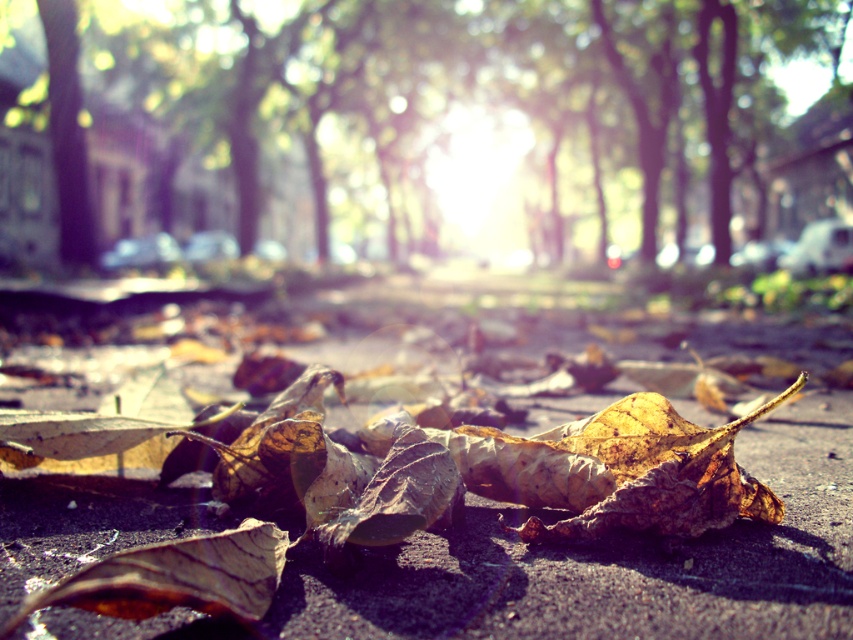
Question: Which object is positioned farthest from the brown papery leaf at lower center?

Choices:
 (A) brown textured leaves at center
 (B) brown/dry leaf at center
 (C) brown/dry leaves at center
 (D) brown papery leaf at lower left

Answer: (C)

Question: Does brown/dry leaves at center have a smaller size compared to brown papery leaf at lower left?

Choices:
 (A) no
 (B) yes

Answer: (A)

Question: Which point is closer to the camera?

Choices:
 (A) [315, 358]
 (B) [259, 554]

Answer: (B)

Question: Does brown papery leaf at lower left have a lesser width compared to brown/dry leaf at center?

Choices:
 (A) yes
 (B) no

Answer: (B)

Question: Is brown/dry leaves at center wider than brown/dry leaf at center?

Choices:
 (A) yes
 (B) no

Answer: (A)

Question: Which point appears farthest from the camera in this image?

Choices:
 (A) (381, 104)
 (B) (347, 515)
 (C) (102, 541)

Answer: (A)